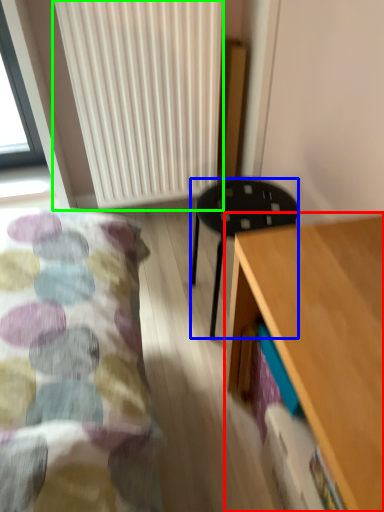
Question: Which object is the closest to the desk (highlighted by a red box)? Choose among these: stool (highlighted by a blue box) or radiator (highlighted by a green box).

Choices:
 (A) stool
 (B) radiator

Answer: (A)